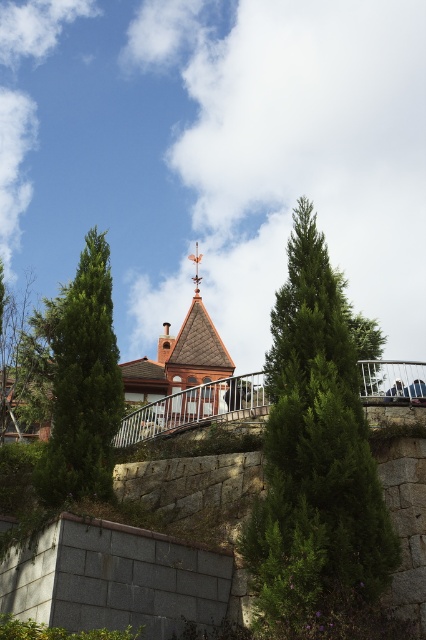
The image size is (426, 640). I want to click on metallic silver person at center, so click(416, 388).

How much distance is there between metallic silver person at center and dark blue jeans at center?

metallic silver person at center and dark blue jeans at center are 30.25 inches apart.

Which is behind, point (417, 392) or point (391, 394)?

Point (391, 394)

Identify the location of metallic silver person at center. The image size is (426, 640). (416, 388).

Where is `green leafy tree at center`? This screenshot has width=426, height=640. green leafy tree at center is located at coordinates (316, 454).

You are a GUI agent. You are given a task and a screenshot of the screen. Output one action in this format:
    pyautogui.click(x=<x>, y=<y>)
    Task: Click on the green leafy tree at center
    The image size is (426, 640).
    Given the screenshot: What is the action you would take?
    pyautogui.click(x=316, y=454)

Between green leafy tree at upper center and dark blue jeans at center, which one is positioned higher?

green leafy tree at upper center is higher up.

The width and height of the screenshot is (426, 640). What do you see at coordinates (365, 333) in the screenshot? I see `green leafy tree at upper center` at bounding box center [365, 333].

I want to click on green leafy tree at upper center, so click(x=365, y=333).